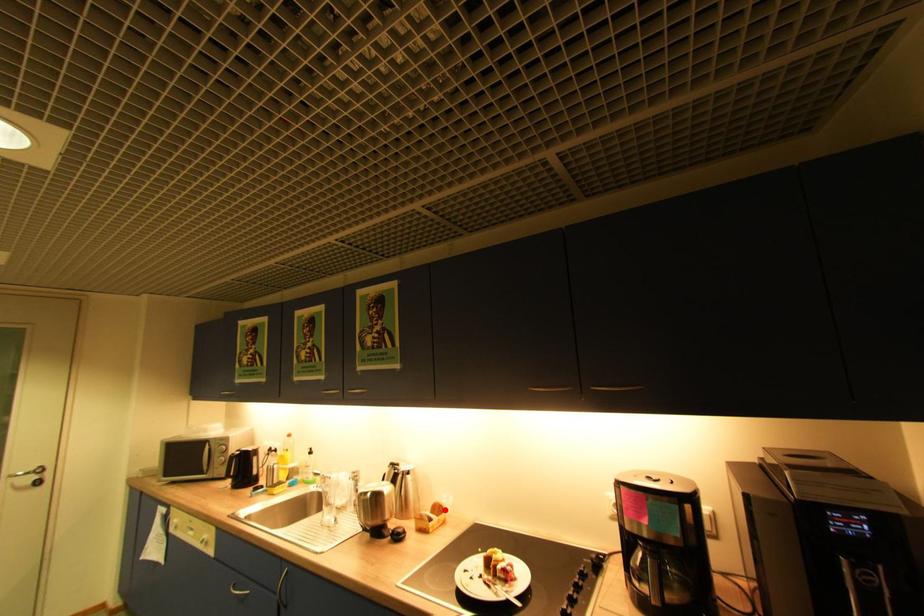
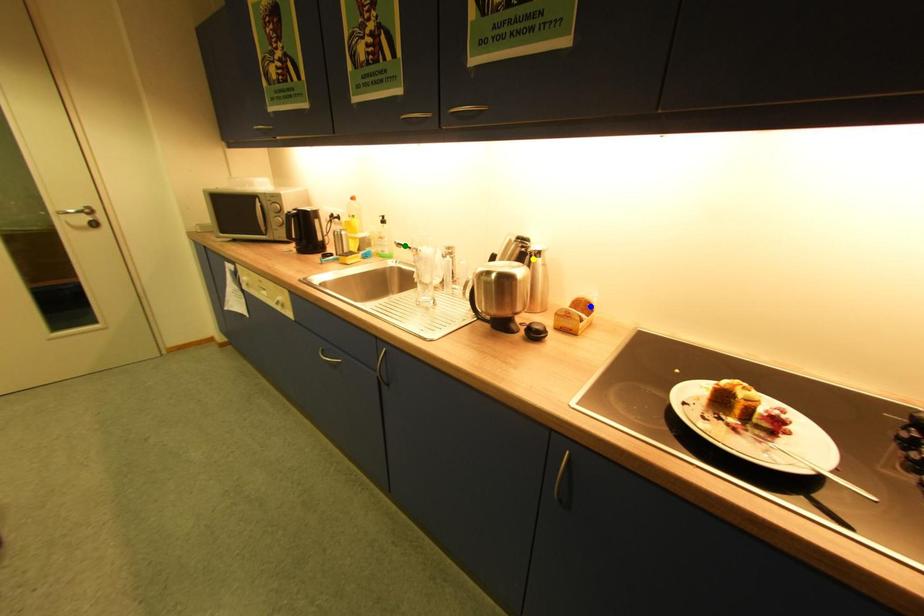
Question: I am providing you with two images of the same scene from different viewpoints. A red point is marked on the first image. You are given multiple points on the second image. Can you choose the point in image 2 that corresponds to the point in image 1?

Choices:
 (A) yellow point
 (B) blue point
 (C) green point

Answer: (B)